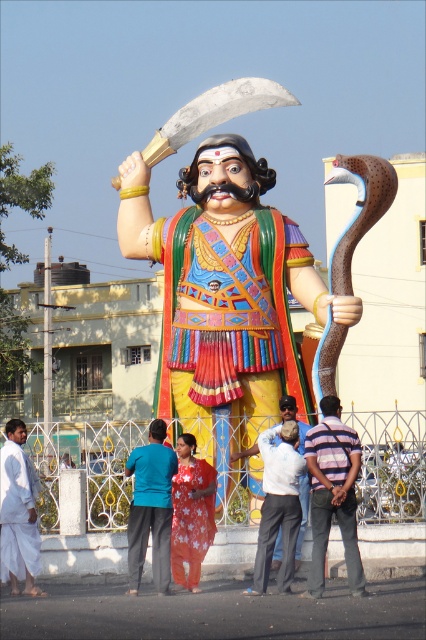
Who is positioned more to the right, striped fabric shirt at center or shiny silver blade at upper center?

striped fabric shirt at center

Is striped fabric shirt at center smaller than shiny silver blade at upper center?

Yes, striped fabric shirt at center is smaller than shiny silver blade at upper center.

Who is more distant from viewer, (345, 476) or (163, 145)?

The point (163, 145) is more distant.

I want to click on striped fabric shirt at center, so click(x=333, y=493).

Between floral fabric saree at center and shiny silver blade at upper center, which one has less height?

floral fabric saree at center

Does point (207, 524) lie in front of point (189, 115)?

Yes, it is.

Is point (170, 566) positioned in front of point (158, 145)?

Yes, point (170, 566) is closer to viewer.

I want to click on floral fabric saree at center, so click(190, 513).

Who is more distant from viewer, (32, 483) or (212, 115)?

Point (212, 115)

Does white cloth at lower left appear on the right side of shiny silver blade at upper center?

No, white cloth at lower left is not to the right of shiny silver blade at upper center.

Between point (0, 484) and point (221, 108), which one is positioned in front?

Positioned in front is point (0, 484).

Find the location of a particular element. The height and width of the screenshot is (640, 426). white cloth at lower left is located at coordinates (19, 513).